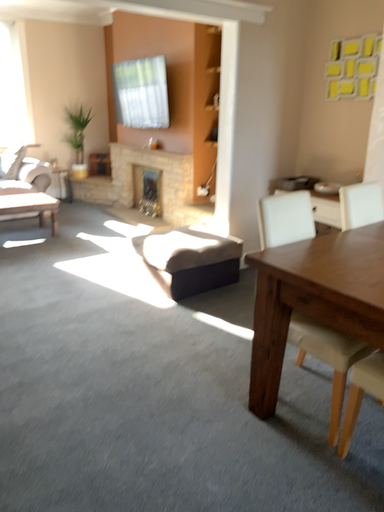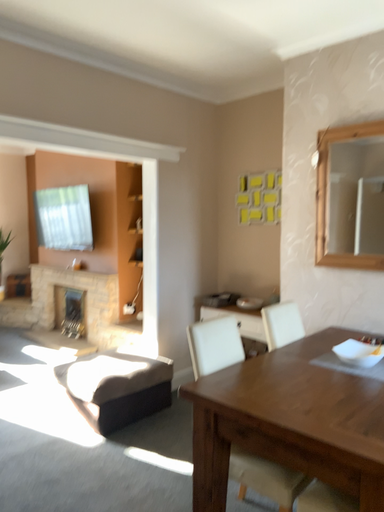
Question: Which way did the camera rotate in the video?

Choices:
 (A) rotated upward
 (B) rotated downward

Answer: (A)